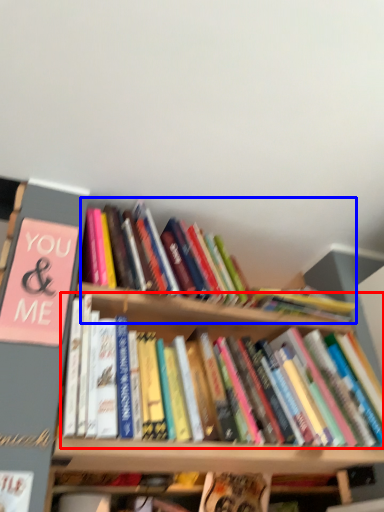
Question: Among these objects, which one is farthest to the camera, book (highlighted by a red box) or book (highlighted by a blue box)?

Choices:
 (A) book
 (B) book

Answer: (B)